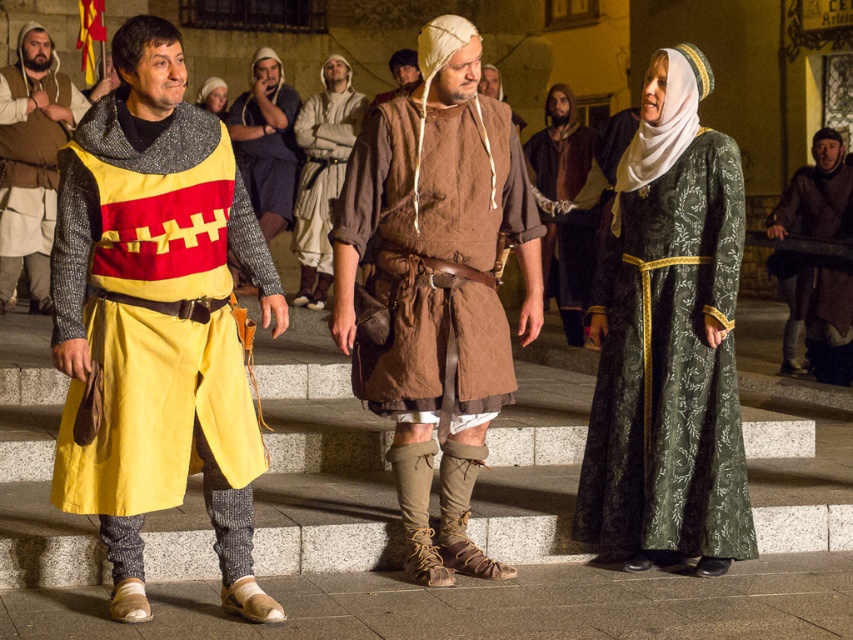
You are a costume designer preparing for a historical play and need to ensure the actors can move comfortably. Given the quilted brown tunic at center and the brown leather vest at center, which garment might restrict movement more due to its narrower width?

The brown leather vest at center is narrower than the quilted brown tunic at center, so it might restrict movement more due to its narrower width.

You are a knight in the medieval scene described. You need to retrieve your armor which is the brown leather armor at center. Where exactly should you look to find it?

→ The brown leather armor at center is located at point (817,195).